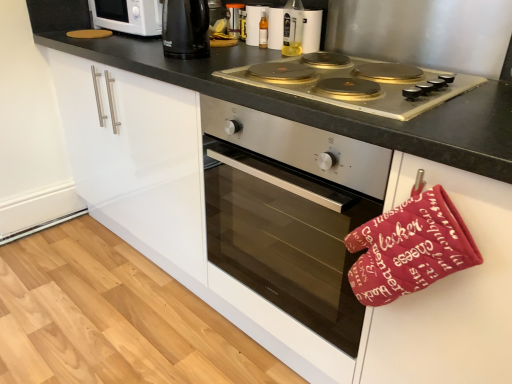
Question: Is translucent plastic bottle at upper center, which is the second bottle from left to right, facing towards white glossy microwave at upper left?

Choices:
 (A) yes
 (B) no

Answer: (B)

Question: Does translucent plastic bottle at upper center, which is the second bottle from left to right, have a larger size compared to white glossy microwave at upper left?

Choices:
 (A) no
 (B) yes

Answer: (A)

Question: From a real-world perspective, does translucent plastic bottle at upper center, the 1th bottle in the front-to-back sequence, stand above white glossy microwave at upper left?

Choices:
 (A) no
 (B) yes

Answer: (B)

Question: Can you confirm if translucent plastic bottle at upper center, which ranks as the 2th bottle in back-to-front order, is wider than white glossy microwave at upper left?

Choices:
 (A) no
 (B) yes

Answer: (A)

Question: Is translucent plastic bottle at upper center, which is the second bottle from left to right, turned away from white glossy microwave at upper left?

Choices:
 (A) yes
 (B) no

Answer: (B)

Question: From the image's perspective, is stainless steel oven at center located above or below translucent plastic bottle at upper center, the 1th bottle in the front-to-back sequence?

Choices:
 (A) below
 (B) above

Answer: (A)

Question: Looking at the image, does stainless steel oven at center seem bigger or smaller compared to translucent plastic bottle at upper center, which is the second bottle from left to right?

Choices:
 (A) small
 (B) big

Answer: (B)

Question: Is point (349, 329) positioned closer to the camera than point (283, 49)?

Choices:
 (A) farther
 (B) closer

Answer: (B)

Question: Would you say stainless steel oven at center is to the left or to the right of translucent plastic bottle at upper center, which ranks as the 2th bottle in back-to-front order, in the picture?

Choices:
 (A) right
 (B) left

Answer: (A)

Question: Considering the positions of black plastic kettle at upper center and white glossy microwave at upper left in the image, is black plastic kettle at upper center taller or shorter than white glossy microwave at upper left?

Choices:
 (A) tall
 (B) short

Answer: (A)

Question: In terms of width, does black plastic kettle at upper center look wider or thinner when compared to white glossy microwave at upper left?

Choices:
 (A) wide
 (B) thin

Answer: (B)

Question: Is black plastic kettle at upper center inside the boundaries of white glossy microwave at upper left, or outside?

Choices:
 (A) inside
 (B) outside

Answer: (B)

Question: Is point (173, 9) closer or farther from the camera than point (91, 16)?

Choices:
 (A) farther
 (B) closer

Answer: (B)

Question: Considering their positions, is stainless steel oven at center located in front of or behind gold-coated stovetop at center?

Choices:
 (A) front
 (B) behind

Answer: (A)

Question: Is stainless steel oven at center inside the boundaries of gold-coated stovetop at center, or outside?

Choices:
 (A) outside
 (B) inside

Answer: (A)